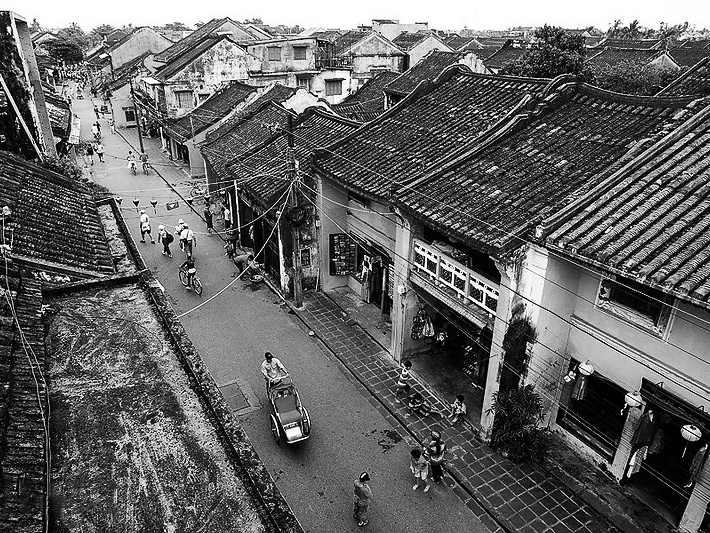
I want to click on hanging wires, so click(x=202, y=231), click(x=160, y=189), click(x=331, y=199), click(x=338, y=224), click(x=561, y=317).